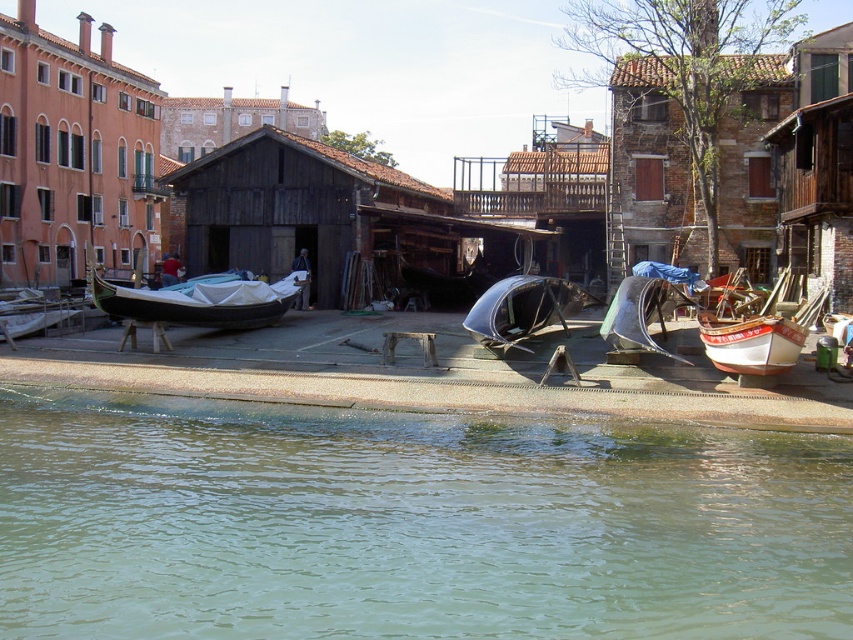
Does black polished wood boat at left have a greater width compared to white wooden boat at right?

In fact, black polished wood boat at left might be narrower than white wooden boat at right.

Which is more to the right, black polished wood boat at left or white wooden boat at right?

Positioned to the right is white wooden boat at right.

Which is behind, point (294, 273) or point (717, 362)?

Point (294, 273)

Identify the location of black polished wood boat at left. (202, 300).

Can you confirm if black polished wood boat at left is positioned to the left of brown wooden hut at upper center?

No, black polished wood boat at left is not to the left of brown wooden hut at upper center.

Does black polished wood boat at left have a greater height compared to brown wooden hut at upper center?

Incorrect, black polished wood boat at left's height is not larger of brown wooden hut at upper center's.

Is point (219, 320) closer to camera compared to point (184, 100)?

Yes, it is in front of point (184, 100).

Find the location of `black polished wood boat at left`. black polished wood boat at left is located at coordinates (202, 300).

Does brown wooden hut at center have a lesser height compared to shiny black car at center?

No.

Locate an element on the screen. brown wooden hut at center is located at coordinates (316, 212).

Where is `brown wooden hut at center`? Image resolution: width=853 pixels, height=640 pixels. brown wooden hut at center is located at coordinates (316, 212).

Identify the location of brown wooden hut at center. The image size is (853, 640). (316, 212).